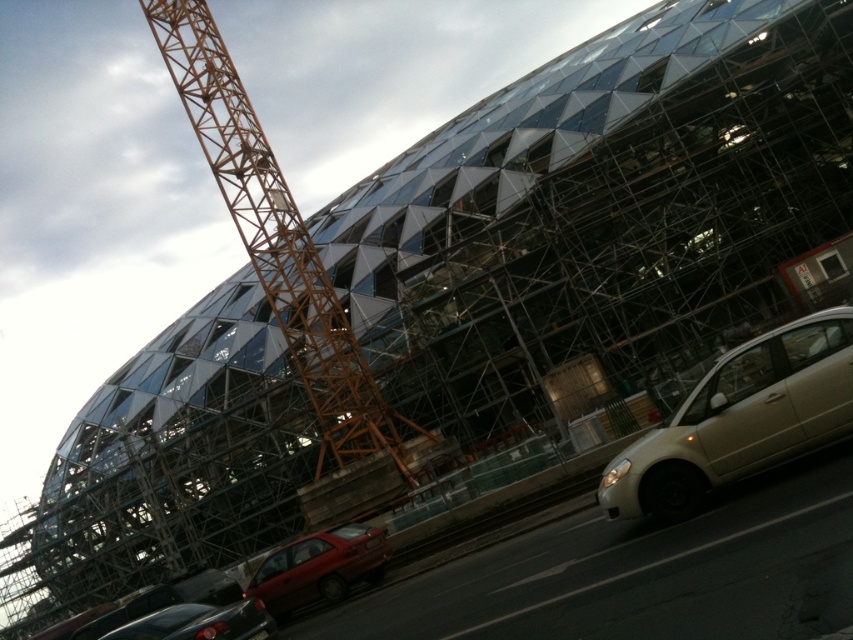
Question: Which point appears closest to the camera in this image?

Choices:
 (A) (753, 452)
 (B) (318, 547)
 (C) (202, 4)
 (D) (224, 612)

Answer: (A)

Question: Can you confirm if orange metallic crane at upper left is thinner than shiny red sedan at lower left?

Choices:
 (A) yes
 (B) no

Answer: (B)

Question: Is orange metallic crane at upper left wider than satin beige sedan at right?

Choices:
 (A) no
 (B) yes

Answer: (B)

Question: Does shiny red sedan at lower left appear on the right side of shiny black sedan at lower left?

Choices:
 (A) no
 (B) yes

Answer: (B)

Question: Which object appears closest to the camera in this image?

Choices:
 (A) satin beige sedan at right
 (B) shiny black sedan at lower left

Answer: (A)

Question: Based on their relative distances, which object is farther from the shiny black sedan at lower left?

Choices:
 (A) orange metallic crane at upper left
 (B) satin beige sedan at right
 (C) shiny red sedan at lower left

Answer: (B)